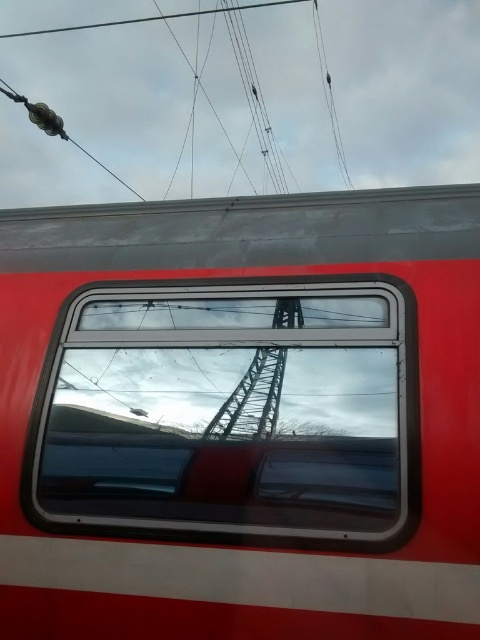
Question: Which of the following is the closest to the observer?

Choices:
 (A) metallic wire at upper center
 (B) metallic red train window at center
 (C) clear glass window at center

Answer: (B)

Question: Is metallic red train window at center positioned in front of metallic wire at upper center?

Choices:
 (A) no
 (B) yes

Answer: (B)

Question: Which of the following is the farthest from the observer?

Choices:
 (A) (288, 637)
 (B) (385, 93)

Answer: (B)

Question: Which of the following is the farthest from the observer?

Choices:
 (A) (459, 40)
 (B) (359, 394)
 (C) (230, 464)

Answer: (A)

Question: Is clear glass window at center behind metallic wire at upper center?

Choices:
 (A) no
 (B) yes

Answer: (A)

Question: Is clear glass window at center smaller than metallic wire at upper center?

Choices:
 (A) no
 (B) yes

Answer: (A)